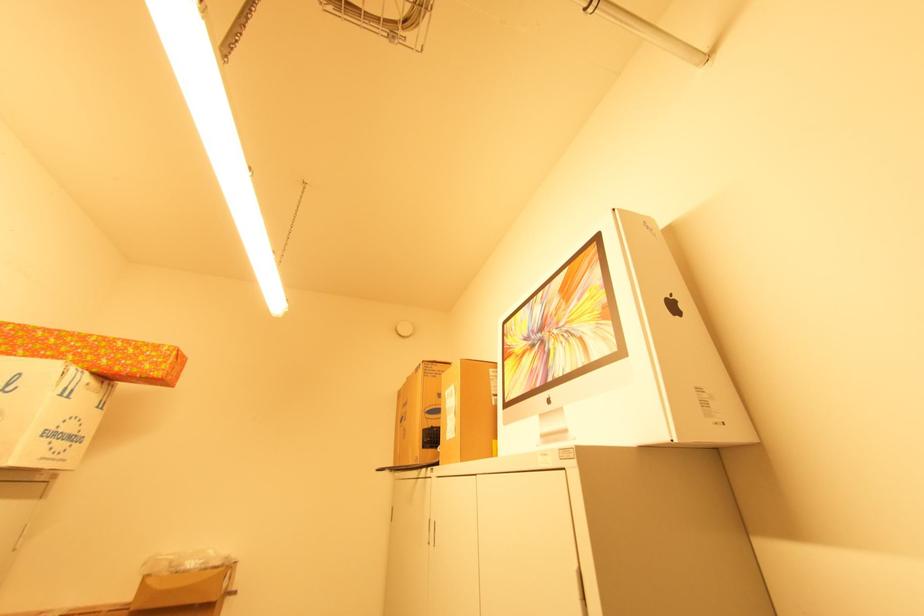
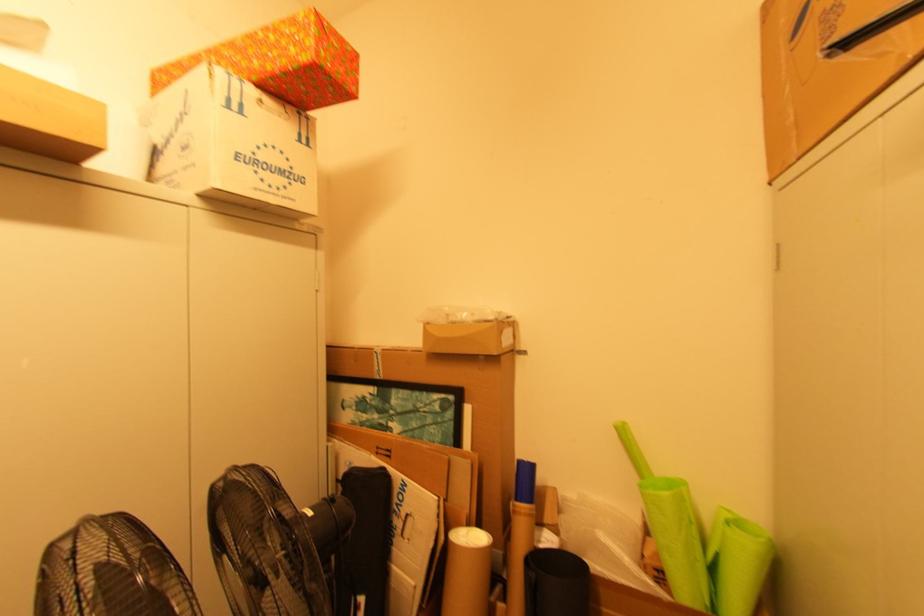
Where in the second image is the point corresponding to [106,362] from the first image?

(258, 63)